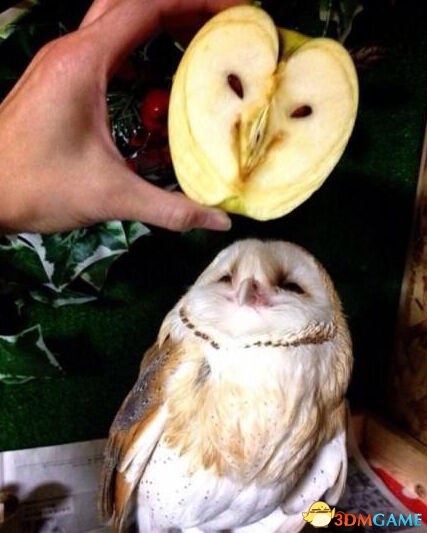
Identify the location of table. (400, 461).